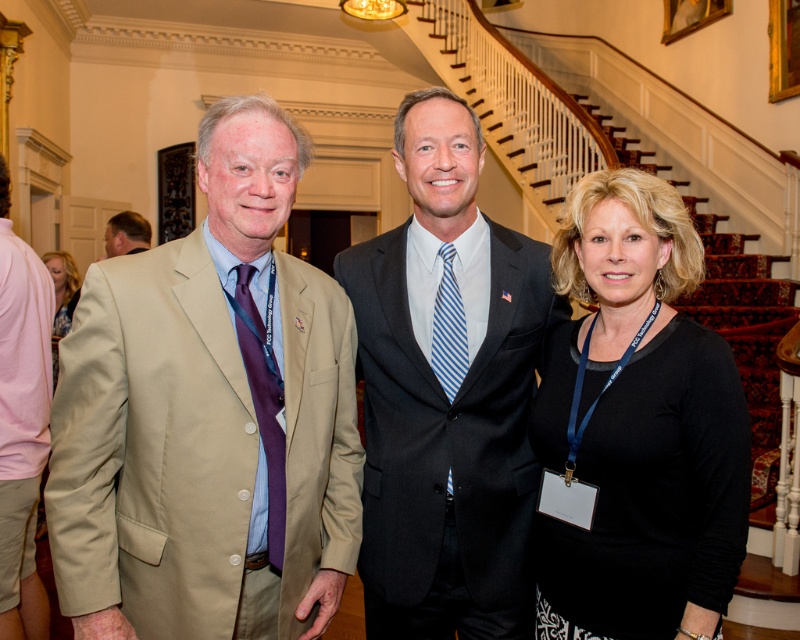
Question: In this image, where is black matte shirt at center located relative to blue striped tie at center?

Choices:
 (A) right
 (B) left

Answer: (A)

Question: Does matte pink dress at left have a smaller size compared to matte beige suit at left?

Choices:
 (A) no
 (B) yes

Answer: (A)

Question: Estimate the real-world distances between objects in this image. Which object is farther from the blue striped tie at center?

Choices:
 (A) tan fabric suit at left
 (B) matte pink dress at left
 (C) pink cotton shirt at left

Answer: (B)

Question: Which object is closer to the camera taking this photo?

Choices:
 (A) dark gray suit at center
 (B) pink cotton shirt at left
 (C) black matte shirt at center

Answer: (C)

Question: Which of the following is the farthest from the observer?

Choices:
 (A) (448, 90)
 (B) (14, 355)
 (C) (274, 438)
 (D) (241, 561)

Answer: (B)

Question: Can you confirm if tan fabric suit at left is smaller than blue striped tie at center?

Choices:
 (A) yes
 (B) no

Answer: (B)